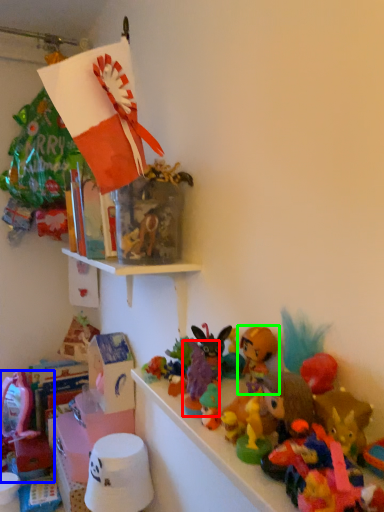
Question: Which object is the closest to the toy (highlighted by a red box)? Choose among these: toy (highlighted by a blue box) or toy (highlighted by a green box).

Choices:
 (A) toy
 (B) toy

Answer: (B)